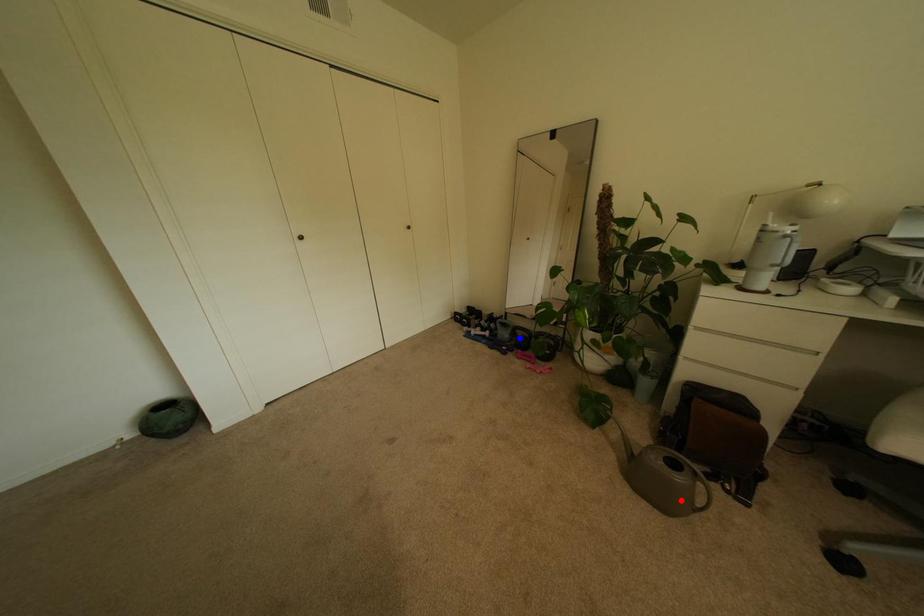
Question: Which of the two points in the image is closer to the camera?

Choices:
 (A) Blue point is closer.
 (B) Red point is closer.

Answer: (B)